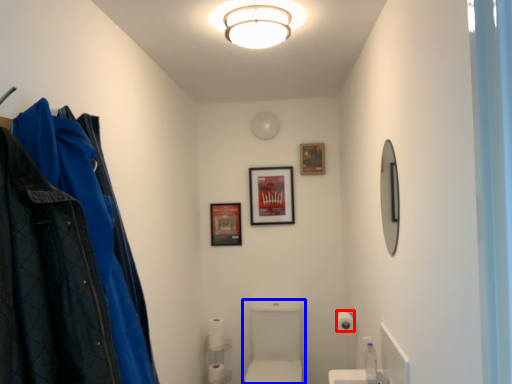
Question: Which object appears closest to the camera in this image, toilet paper (highlighted by a red box) or sink (highlighted by a blue box)?

Choices:
 (A) toilet paper
 (B) sink

Answer: (B)